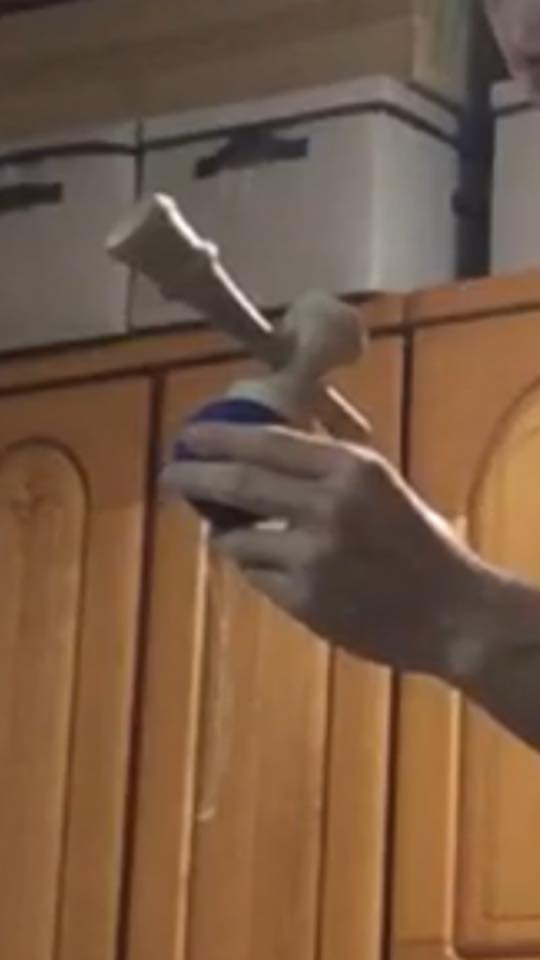
Identify the location of handle. The width and height of the screenshot is (540, 960). click(249, 142), click(25, 197).